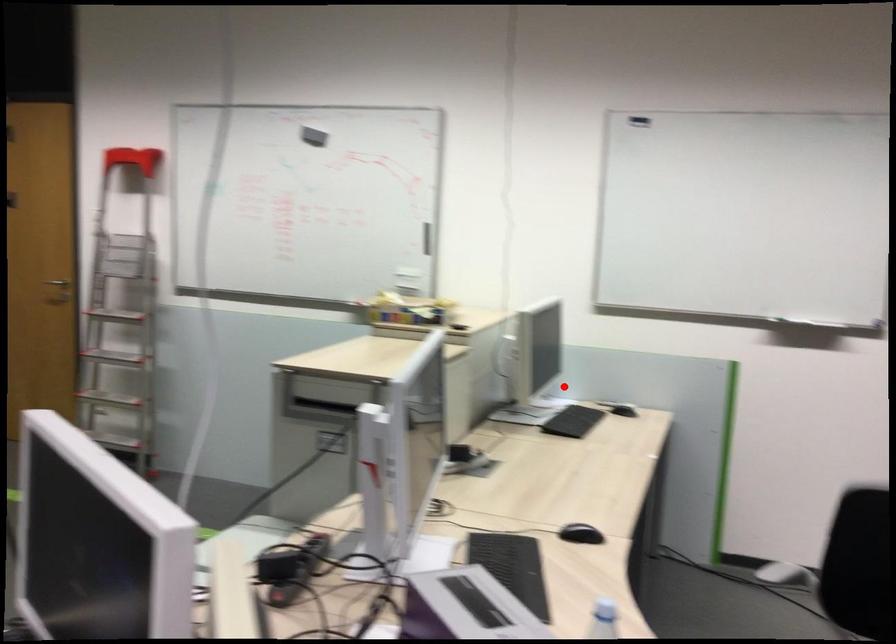
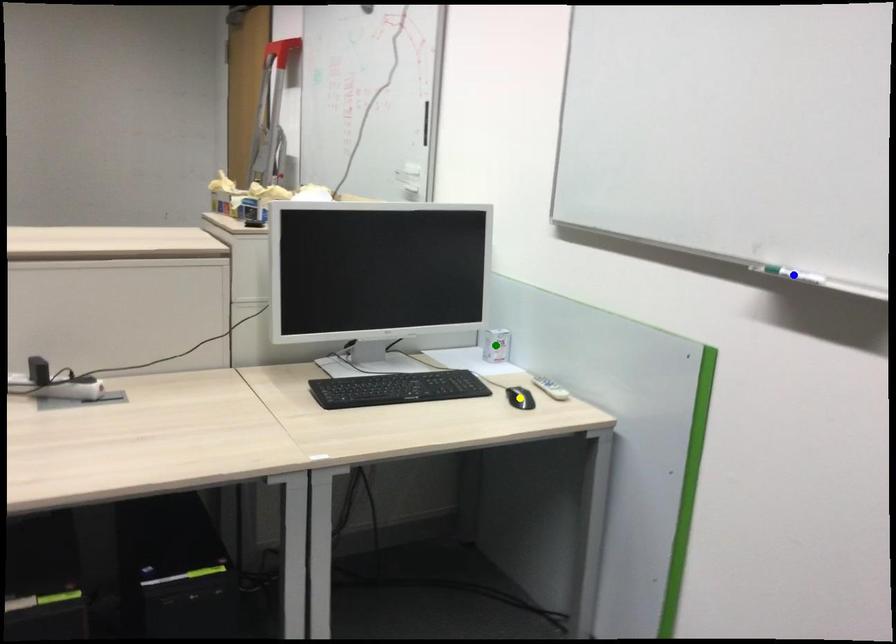
Question: I am providing you with two images of the same scene from different viewpoints. A red point is marked on the first image. You are given multiple points on the second image. Can you choose the point in image 2 that corresponds to the point in image 1?

Choices:
 (A) yellow point
 (B) blue point
 (C) green point

Answer: (C)